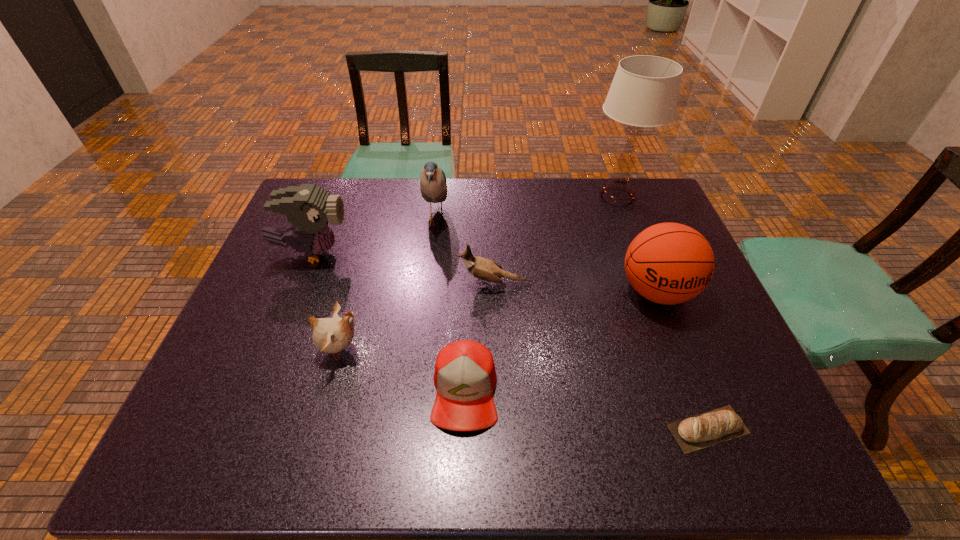
Locate an element on the screen. The height and width of the screenshot is (540, 960). vacant area at the far edge of the desktop is located at coordinates (530, 195).

The height and width of the screenshot is (540, 960). I want to click on free region at the near edge of the desktop, so pyautogui.click(x=518, y=443).

What are the coordinates of `vacant space at the left edge of the desktop` in the screenshot? It's located at (x=291, y=248).

The height and width of the screenshot is (540, 960). I want to click on free region at the right edge, so click(x=677, y=334).

This screenshot has height=540, width=960. In the image, there is a desktop. Identify the location of vacant space at the far left corner. (348, 184).

Find the location of a particular element. The width and height of the screenshot is (960, 540). blank space at the far right corner of the desktop is located at coordinates (659, 193).

Locate an element on the screen. free space that is in between the nearest bird and the basketball is located at coordinates point(499,320).

You are a GUI agent. You are given a task and a screenshot of the screen. Output one action in this format:
    pyautogui.click(x=<x>, y=<y>)
    Task: Click on the vacant space that is in between the baseball cap and the second nearest bird
    The width and height of the screenshot is (960, 540).
    Given the screenshot: What is the action you would take?
    pyautogui.click(x=480, y=337)

I want to click on empty location between the seventh tallest object and the third nearest bird, so click(389, 322).

Identify the location of free space between the shortest object and the baseball cap. The height and width of the screenshot is (540, 960). (587, 410).